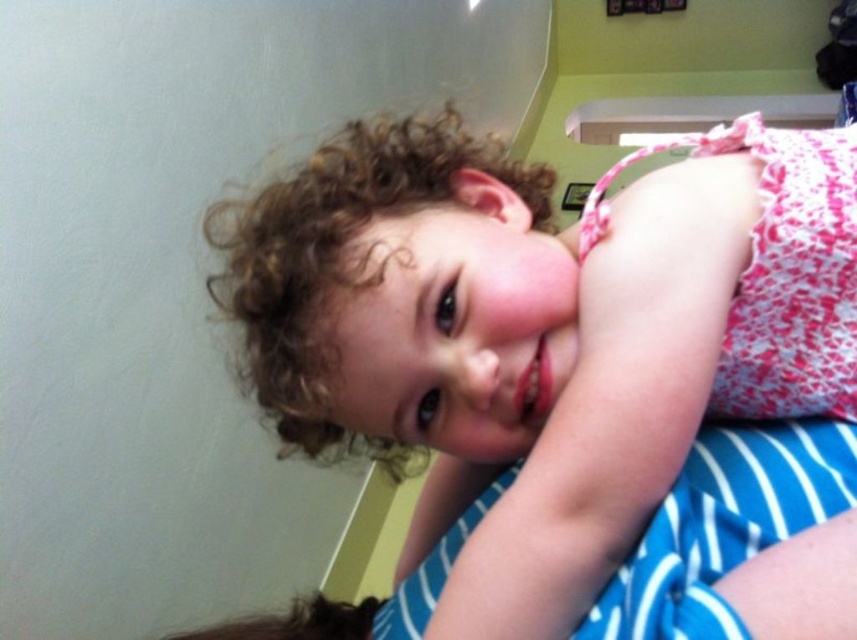
Which of these two, pink lace dress at center or blue striped fabric at lower right, stands shorter?

blue striped fabric at lower right is shorter.

What do you see at coordinates (567, 378) in the screenshot?
I see `pink lace dress at center` at bounding box center [567, 378].

Is point (721, 323) farther from viewer compared to point (720, 634)?

That is True.

This screenshot has width=857, height=640. I want to click on pink lace dress at center, so click(567, 378).